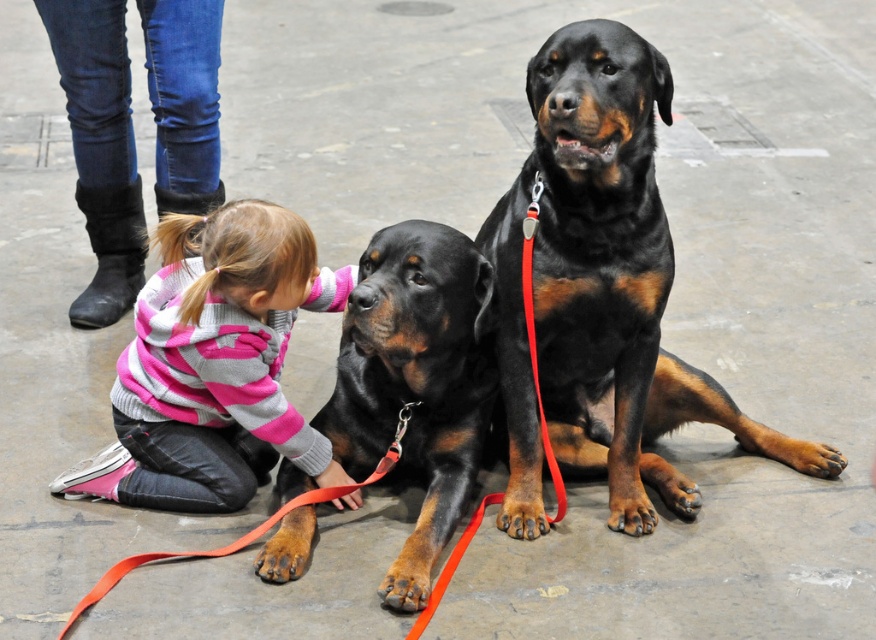
Who is positioned more to the right, black glossy dog at center or pink striped sweater at lower left?

black glossy dog at center is more to the right.

I want to click on black glossy dog at center, so click(601, 291).

At what (x,y) coordinates should I click in order to perform the action: click on black glossy dog at center. Please return your answer as a coordinate pair (x, y). The height and width of the screenshot is (640, 876). Looking at the image, I should click on (601, 291).